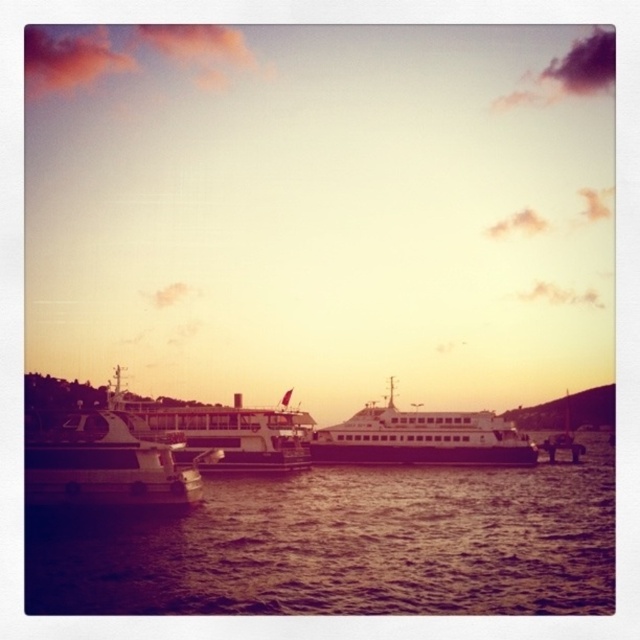
You are an observer standing at the edge of the harbor. You notice the brown water at center and the white matte boat at center. Which object is wider?

The brown water at center is wider than the white matte boat at center.

You are a photographer planning to capture the sunset reflections on the water. You notice the white glossy ferry at left and the metallic white ferry at center. Which ferry do you need to position your camera closer to in order to capture the reflection of both ferries in the water simultaneously?

The white glossy ferry at left is positioned under the metallic white ferry at center, so positioning the camera closer to the white glossy ferry at left will allow you to capture the reflection of both ferries in the water simultaneously.